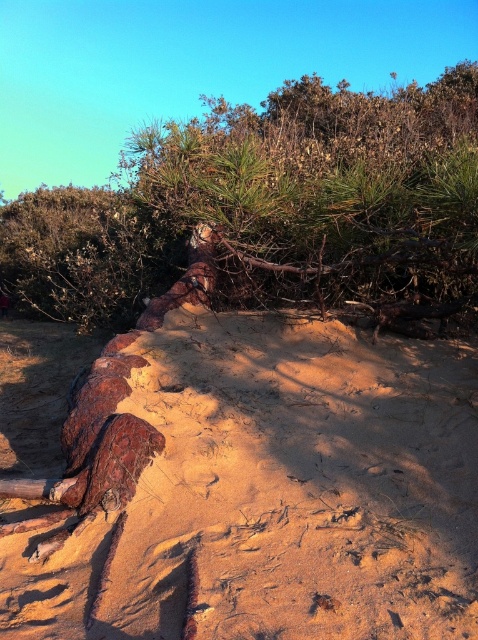
You are a hiker trying to cross the sandy dune and need to step over or around the rusty metallic log at lower left and the brown bark tree at center. Which object requires a wider path to navigate around?

The brown bark tree at center requires a wider path since it is larger than the rusty metallic log at lower left.

You are standing at the point with coordinates point (x=268, y=490) in the image. What object is located at that point?

The point (x=268, y=490) corresponds to the rusty metallic log at lower left.

You are standing at the center of the sandy dune in the image and want to reach the rusty metallic log at lower left. According to the coordinates provided, what direction should you move in to reach it?

The rusty metallic log at lower left is located at coordinates point (268, 490). Since the log is at lower left, you should move towards the lower left direction to reach it.